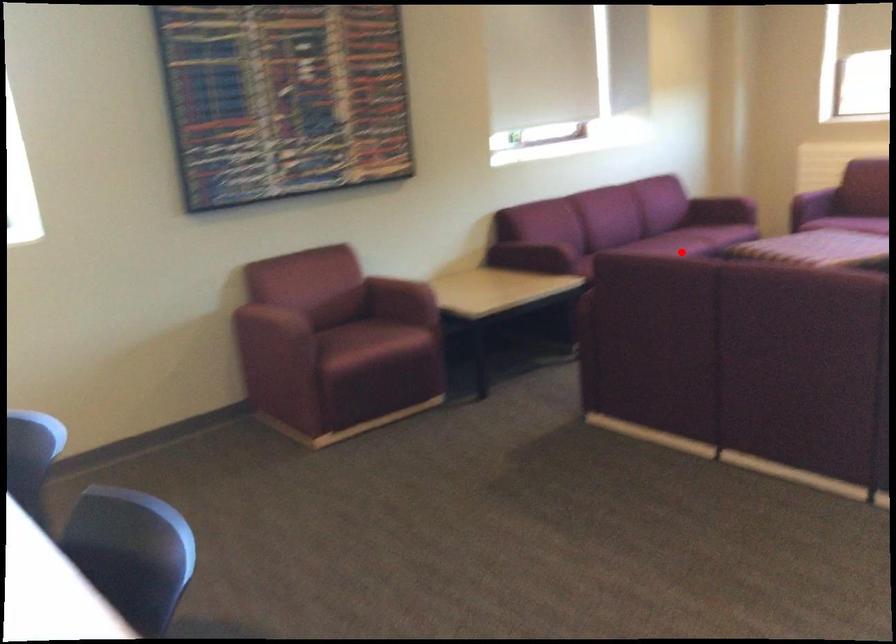
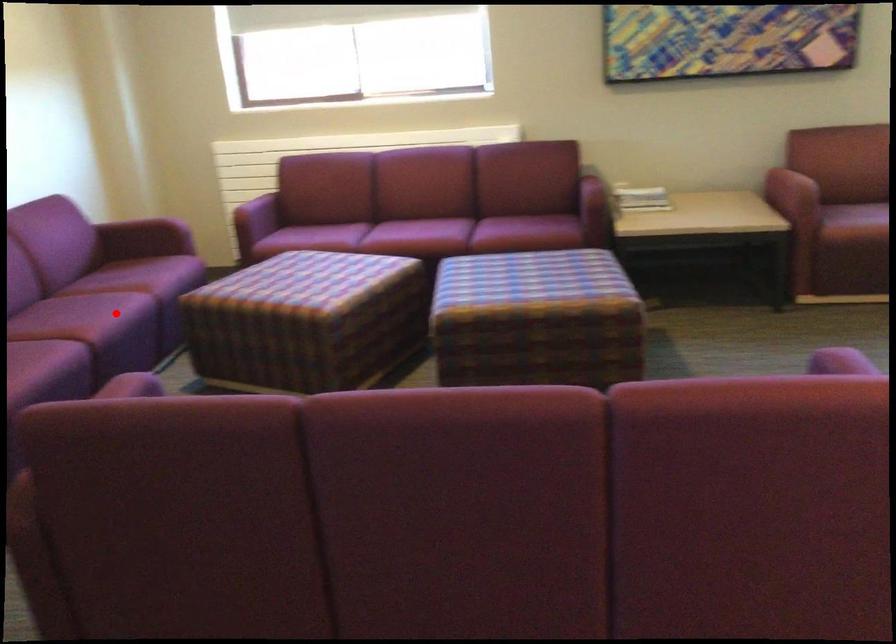
I am providing you with two images of the same scene from different viewpoints. A red point is marked on the first image and another point is marked on the second image. Do the highlighted points in image1 and image2 indicate the same real-world spot?

Yes